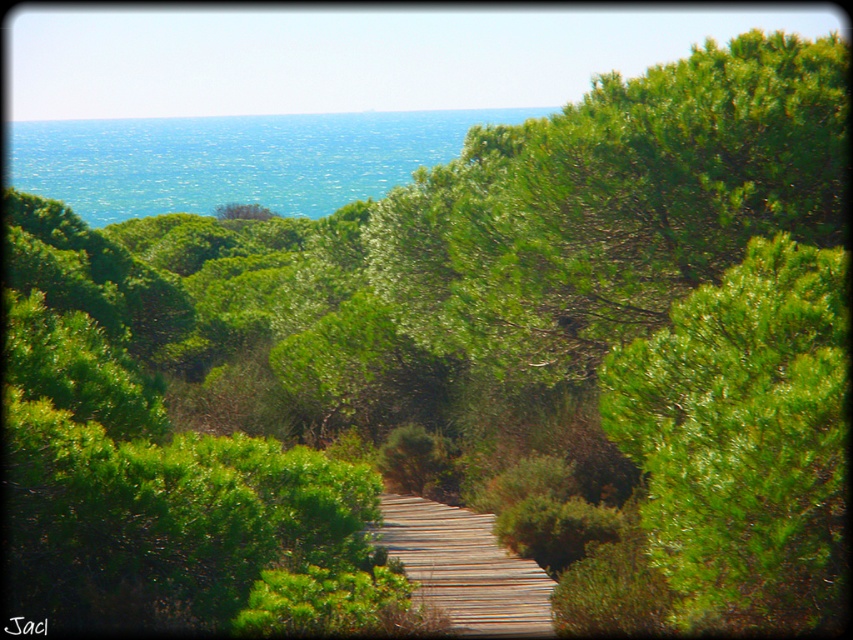
You are planning to plant a new tree in this coastal area. The green leafy tree at upper right and the wooden at center are both present. Which one has a larger canopy spread?

The green leafy tree at upper right has a larger canopy spread than the wooden at center, as it is described as bigger.